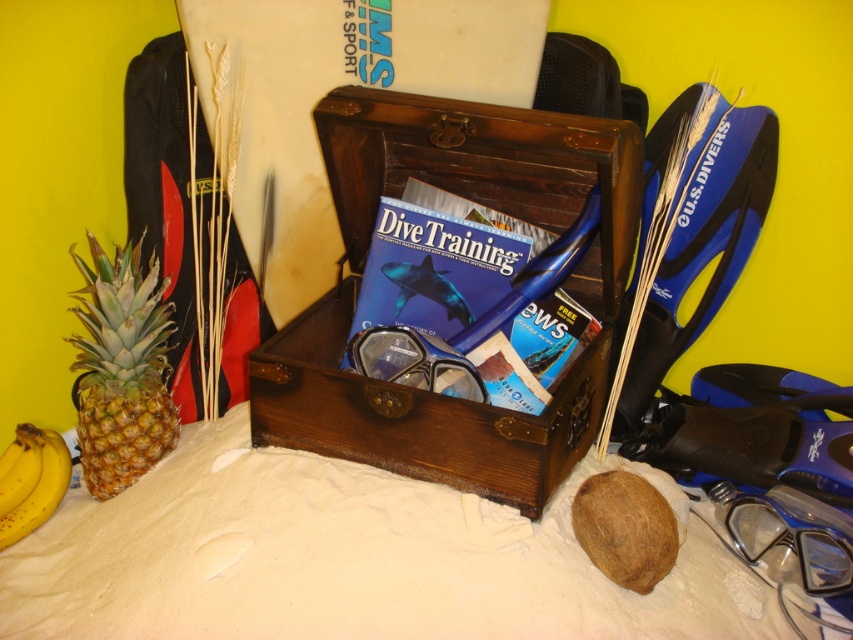
Does yellow textured pineapple at left have a lesser width compared to clear plastic goggles at center?

Correct, yellow textured pineapple at left's width is less than clear plastic goggles at center's.

Is point (80, 436) in front of point (380, 339)?

That is False.

What are the coordinates of `yellow textured pineapple at left` in the screenshot? It's located at (120, 369).

Between transparent plastic goggles at lower right and yellow matte bananas at lower left, which one has less height?

With less height is transparent plastic goggles at lower right.

Can you confirm if transparent plastic goggles at lower right is smaller than yellow matte bananas at lower left?

No, transparent plastic goggles at lower right is not smaller than yellow matte bananas at lower left.

Where is `transparent plastic goggles at lower right`? The image size is (853, 640). transparent plastic goggles at lower right is located at coordinates point(787,536).

Does wooden chest at center appear under clear plastic goggles at center?

No, wooden chest at center is not below clear plastic goggles at center.

The height and width of the screenshot is (640, 853). What do you see at coordinates (482, 204) in the screenshot? I see `wooden chest at center` at bounding box center [482, 204].

The height and width of the screenshot is (640, 853). What are the coordinates of `wooden chest at center` in the screenshot? It's located at (482, 204).